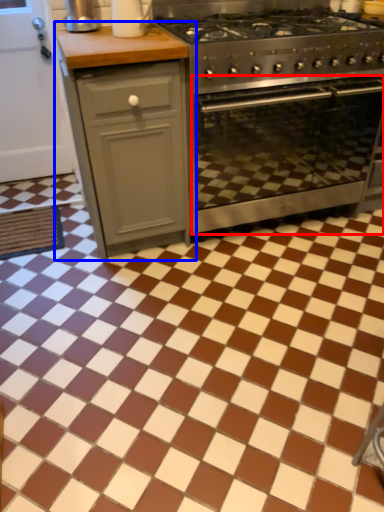
Question: Which point is further to the camera, oven (highlighted by a red box) or cabinetry (highlighted by a blue box)?

Choices:
 (A) oven
 (B) cabinetry

Answer: (A)